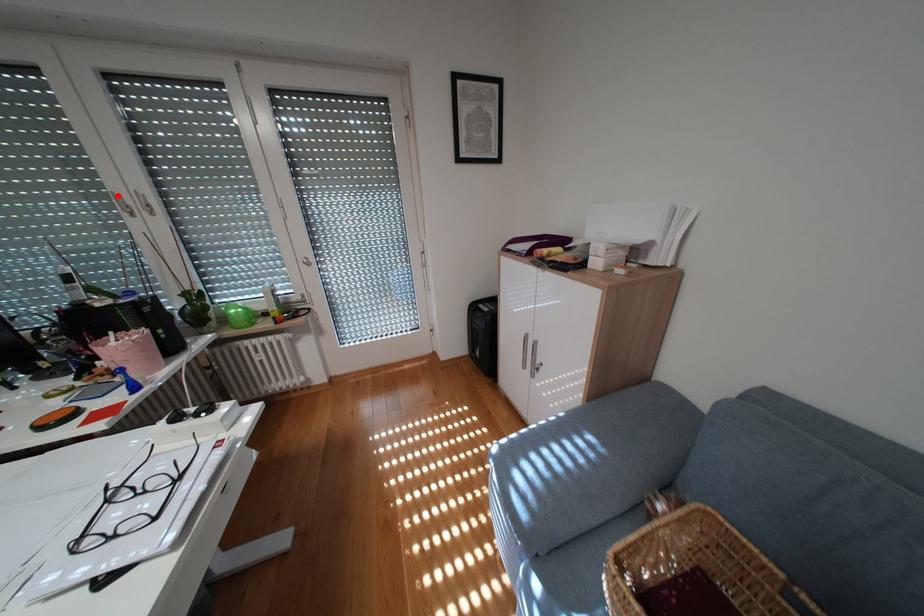
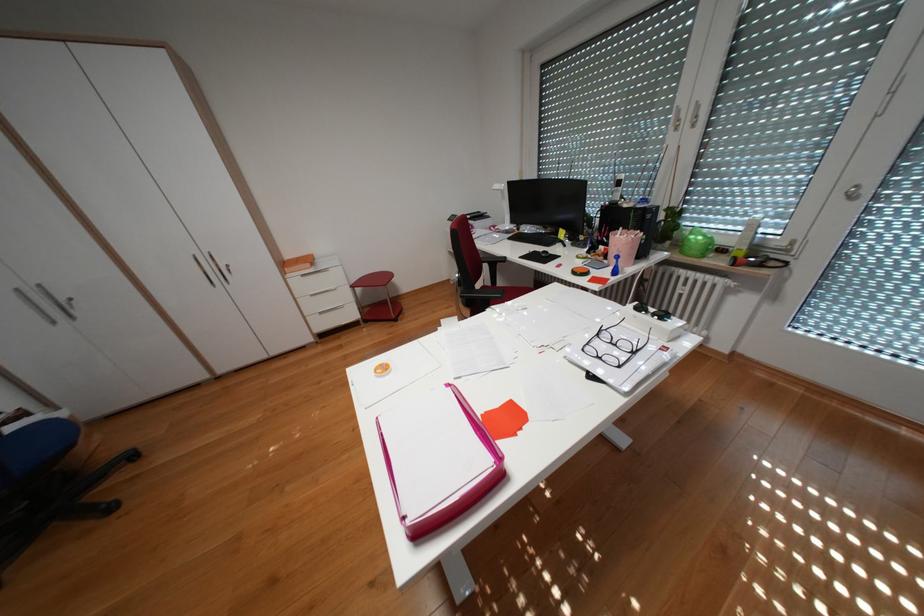
Where in the second image is the point corresponding to the highlighted location from the first image?

(682, 111)